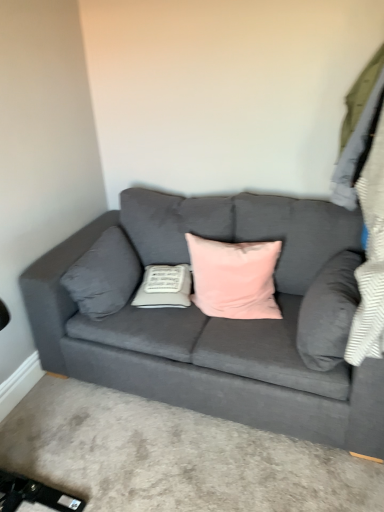
Describe the element at coordinates (329, 312) in the screenshot. The height and width of the screenshot is (512, 384). I see `velvet gray pillow at right, the fourth pillow from the left` at that location.

Describe the element at coordinates (234, 278) in the screenshot. I see `pink velvet pillow at center, placed as the 2th pillow when sorted from right to left` at that location.

This screenshot has width=384, height=512. Identify the location of gray fabric pillow at left, the 4th pillow viewed from the right. (104, 275).

Where is `white fabric pillow at center, placed as the second pillow when sorted from left to right`? This screenshot has width=384, height=512. white fabric pillow at center, placed as the second pillow when sorted from left to right is located at coordinates (164, 287).

In order to face white fabric pillow at center, placed as the second pillow when sorted from left to right, should I rotate leftwards or rightwards?

Turn left by 3.557 degrees to look at white fabric pillow at center, placed as the second pillow when sorted from left to right.

Identify the location of velvet gray couch at center. (212, 320).

This screenshot has width=384, height=512. In order to click on pillow below the white fabric pillow at center, the third pillow in the right-to-left sequence (from the image's perspective) in this screenshot , I will do `click(329, 312)`.

Can you confirm if white fabric pillow at center, the third pillow in the right-to-left sequence, is smaller than velvet gray pillow at right, the fourth pillow from the left?

Yes, white fabric pillow at center, the third pillow in the right-to-left sequence, is smaller than velvet gray pillow at right, the fourth pillow from the left.

From a real-world perspective, is white fabric pillow at center, placed as the second pillow when sorted from left to right, positioned over velvet gray pillow at right, marked as the first pillow in a right-to-left arrangement, based on gravity?

No, from a real-world perspective, white fabric pillow at center, placed as the second pillow when sorted from left to right, is not above velvet gray pillow at right, marked as the first pillow in a right-to-left arrangement.

From the image's perspective, is white fabric pillow at center, placed as the second pillow when sorted from left to right, above velvet gray pillow at right, marked as the first pillow in a right-to-left arrangement?

Correct, white fabric pillow at center, placed as the second pillow when sorted from left to right, appears higher than velvet gray pillow at right, marked as the first pillow in a right-to-left arrangement, in the image.

Is velvet gray couch at center directly adjacent to velvet gray pillow at right, the fourth pillow from the left?

No, velvet gray couch at center is not with velvet gray pillow at right, the fourth pillow from the left.

Between velvet gray couch at center and velvet gray pillow at right, marked as the first pillow in a right-to-left arrangement, which one is positioned in front?

velvet gray couch at center.

Is velvet gray couch at center inside the boundaries of velvet gray pillow at right, the fourth pillow from the left, or outside?

velvet gray couch at center is not enclosed by velvet gray pillow at right, the fourth pillow from the left.

From a real-world perspective, which object stands above the other?

velvet gray pillow at right, marked as the first pillow in a right-to-left arrangement.

Is velvet gray couch at center bigger than pink velvet pillow at center, placed as the 2th pillow when sorted from right to left?

Correct, velvet gray couch at center is larger in size than pink velvet pillow at center, placed as the 2th pillow when sorted from right to left.

Consider the image. Does velvet gray couch at center contain pink velvet pillow at center, the third pillow in the left-to-right sequence?

Yes.

From the image's perspective, is velvet gray couch at center under pink velvet pillow at center, placed as the 2th pillow when sorted from right to left?

Yes, from the image's perspective, velvet gray couch at center is below pink velvet pillow at center, placed as the 2th pillow when sorted from right to left.

From a real-world perspective, is velvet gray couch at center physically above pink velvet pillow at center, the third pillow in the left-to-right sequence?

Actually, velvet gray couch at center is physically below pink velvet pillow at center, the third pillow in the left-to-right sequence, in the real world.

From a real-world perspective, is pink velvet pillow at center, the third pillow in the left-to-right sequence, physically below gray fabric pillow at left, marked as the 1th pillow in a left-to-right arrangement?

Actually, pink velvet pillow at center, the third pillow in the left-to-right sequence, is physically above gray fabric pillow at left, marked as the 1th pillow in a left-to-right arrangement, in the real world.

Is the position of pink velvet pillow at center, placed as the 2th pillow when sorted from right to left, less distant than that of gray fabric pillow at left, marked as the 1th pillow in a left-to-right arrangement?

Yes, pink velvet pillow at center, placed as the 2th pillow when sorted from right to left, is in front of gray fabric pillow at left, marked as the 1th pillow in a left-to-right arrangement.

Could you tell me if pink velvet pillow at center, the third pillow in the left-to-right sequence, is facing gray fabric pillow at left, marked as the 1th pillow in a left-to-right arrangement?

No, pink velvet pillow at center, the third pillow in the left-to-right sequence, is not aimed at gray fabric pillow at left, marked as the 1th pillow in a left-to-right arrangement.

Considering the relative sizes of pink velvet pillow at center, the third pillow in the left-to-right sequence, and gray fabric pillow at left, the 4th pillow viewed from the right, in the image provided, is pink velvet pillow at center, the third pillow in the left-to-right sequence, smaller than gray fabric pillow at left, the 4th pillow viewed from the right,?

Actually, pink velvet pillow at center, the third pillow in the left-to-right sequence, might be larger than gray fabric pillow at left, the 4th pillow viewed from the right.

Considering the positions of objects velvet gray pillow at right, marked as the first pillow in a right-to-left arrangement, and velvet gray couch at center in the image provided, who is in front, velvet gray pillow at right, marked as the first pillow in a right-to-left arrangement, or velvet gray couch at center?

velvet gray couch at center.

Is velvet gray pillow at right, marked as the first pillow in a right-to-left arrangement, far from velvet gray couch at center?

No, velvet gray pillow at right, marked as the first pillow in a right-to-left arrangement, is not far from velvet gray couch at center.

Is velvet gray pillow at right, marked as the first pillow in a right-to-left arrangement, turned away from velvet gray couch at center?

Yes, velvet gray pillow at right, marked as the first pillow in a right-to-left arrangement,'s orientation is away from velvet gray couch at center.

Looking at their sizes, would you say gray fabric pillow at left, the 4th pillow viewed from the right, is wider or thinner than white fabric pillow at center, the third pillow in the right-to-left sequence?

gray fabric pillow at left, the 4th pillow viewed from the right, is thinner than white fabric pillow at center, the third pillow in the right-to-left sequence.

Is gray fabric pillow at left, the 4th pillow viewed from the right, far away from white fabric pillow at center, the third pillow in the right-to-left sequence?

gray fabric pillow at left, the 4th pillow viewed from the right, is actually quite close to white fabric pillow at center, the third pillow in the right-to-left sequence.

Is white fabric pillow at center, the third pillow in the right-to-left sequence, surrounded by gray fabric pillow at left, the 4th pillow viewed from the right?

That's incorrect, white fabric pillow at center, the third pillow in the right-to-left sequence, is not inside gray fabric pillow at left, the 4th pillow viewed from the right.

Can you tell me how much gray fabric pillow at left, the 4th pillow viewed from the right, and white fabric pillow at center, placed as the second pillow when sorted from left to right, differ in facing direction?

The facing directions of gray fabric pillow at left, the 4th pillow viewed from the right, and white fabric pillow at center, placed as the second pillow when sorted from left to right, are 75.9 degrees apart.

Could you tell me if gray fabric pillow at left, marked as the 1th pillow in a left-to-right arrangement, is turned towards pink velvet pillow at center, placed as the 2th pillow when sorted from right to left?

Yes, gray fabric pillow at left, marked as the 1th pillow in a left-to-right arrangement, is aimed at pink velvet pillow at center, placed as the 2th pillow when sorted from right to left.

Does point (136, 279) come behind point (220, 260)?

Yes, it is.

Is gray fabric pillow at left, marked as the 1th pillow in a left-to-right arrangement, beside pink velvet pillow at center, placed as the 2th pillow when sorted from right to left?

gray fabric pillow at left, marked as the 1th pillow in a left-to-right arrangement, and pink velvet pillow at center, placed as the 2th pillow when sorted from right to left, are clearly separated.

Which pillow is the 3rd one when counting from the front of the white fabric pillow at center, placed as the second pillow when sorted from left to right? Please provide its 2D coordinates.

[(329, 312)]

Where is `the 1st pillow behind the velvet gray couch at center`? This screenshot has height=512, width=384. the 1st pillow behind the velvet gray couch at center is located at coordinates (329, 312).

Looking at this image, from the image, which object appears to be nearer to pink velvet pillow at center, the third pillow in the left-to-right sequence, velvet gray pillow at right, marked as the first pillow in a right-to-left arrangement, or white fabric pillow at center, the third pillow in the right-to-left sequence?

white fabric pillow at center, the third pillow in the right-to-left sequence, lies closer to pink velvet pillow at center, the third pillow in the left-to-right sequence, than the other object.

Estimate the real-world distances between objects in this image. Which object is closer to gray fabric pillow at left, marked as the 1th pillow in a left-to-right arrangement, velvet gray pillow at right, marked as the first pillow in a right-to-left arrangement, or white fabric pillow at center, placed as the second pillow when sorted from left to right?

white fabric pillow at center, placed as the second pillow when sorted from left to right.

Considering their positions, is gray fabric pillow at left, the 4th pillow viewed from the right, positioned closer to pink velvet pillow at center, placed as the 2th pillow when sorted from right to left, than velvet gray couch at center?

velvet gray couch at center.

Looking at the image, which one is located closer to white fabric pillow at center, the third pillow in the right-to-left sequence, gray fabric pillow at left, marked as the 1th pillow in a left-to-right arrangement, or velvet gray pillow at right, marked as the first pillow in a right-to-left arrangement?

The object closer to white fabric pillow at center, the third pillow in the right-to-left sequence, is gray fabric pillow at left, marked as the 1th pillow in a left-to-right arrangement.

When comparing their distances from gray fabric pillow at left, the 4th pillow viewed from the right, does velvet gray couch at center or velvet gray pillow at right, the fourth pillow from the left, seem further?

velvet gray pillow at right, the fourth pillow from the left, is further to gray fabric pillow at left, the 4th pillow viewed from the right.

Looking at the image, which one is located further to pink velvet pillow at center, the third pillow in the left-to-right sequence, velvet gray pillow at right, marked as the first pillow in a right-to-left arrangement, or velvet gray couch at center?

velvet gray pillow at right, marked as the first pillow in a right-to-left arrangement.

Consider the image. Which object lies nearer to the anchor point velvet gray couch at center, velvet gray pillow at right, the fourth pillow from the left, or pink velvet pillow at center, placed as the 2th pillow when sorted from right to left?

The object closer to velvet gray couch at center is pink velvet pillow at center, placed as the 2th pillow when sorted from right to left.

When comparing their distances from velvet gray pillow at right, the fourth pillow from the left, does pink velvet pillow at center, placed as the 2th pillow when sorted from right to left, or white fabric pillow at center, placed as the second pillow when sorted from left to right, seem further?

white fabric pillow at center, placed as the second pillow when sorted from left to right, is further to velvet gray pillow at right, the fourth pillow from the left.

Locate an element on the screen. pillow between velvet gray couch at center and pink velvet pillow at center, placed as the 2th pillow when sorted from right to left, from front to back is located at coordinates (329, 312).

At what (x,y) coordinates should I click in order to perform the action: click on studio couch between gray fabric pillow at left, marked as the 1th pillow in a left-to-right arrangement, and velvet gray pillow at right, marked as the first pillow in a right-to-left arrangement. Please return your answer as a coordinate pair (x, y). Looking at the image, I should click on (212, 320).

Image resolution: width=384 pixels, height=512 pixels. Identify the location of pillow situated between gray fabric pillow at left, marked as the 1th pillow in a left-to-right arrangement, and pink velvet pillow at center, placed as the 2th pillow when sorted from right to left, from left to right. (164, 287).

Image resolution: width=384 pixels, height=512 pixels. Find the location of `studio couch situated between gray fabric pillow at left, marked as the 1th pillow in a left-to-right arrangement, and pink velvet pillow at center, the third pillow in the left-to-right sequence, from left to right`. studio couch situated between gray fabric pillow at left, marked as the 1th pillow in a left-to-right arrangement, and pink velvet pillow at center, the third pillow in the left-to-right sequence, from left to right is located at coordinates (212, 320).